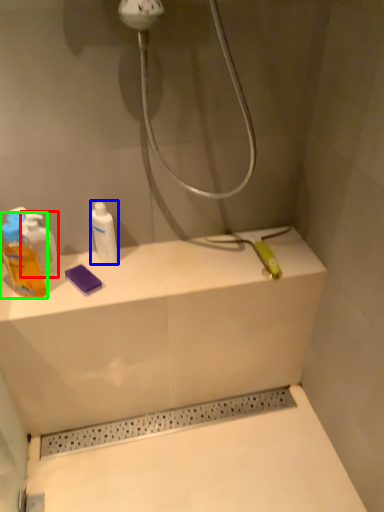
Question: Estimate the real-world distances between objects in this image. Which object is farther from mouthwash (highlighted by a red box), mouthwash (highlighted by a blue box) or mouthwash (highlighted by a green box)?

Choices:
 (A) mouthwash
 (B) mouthwash

Answer: (A)